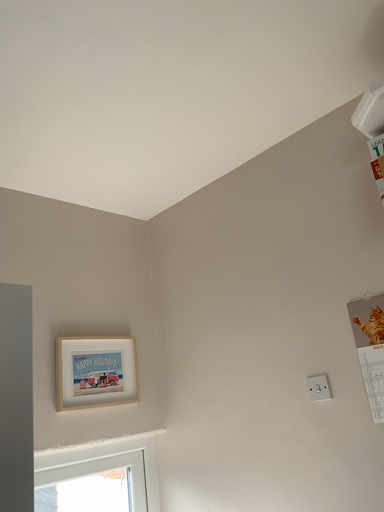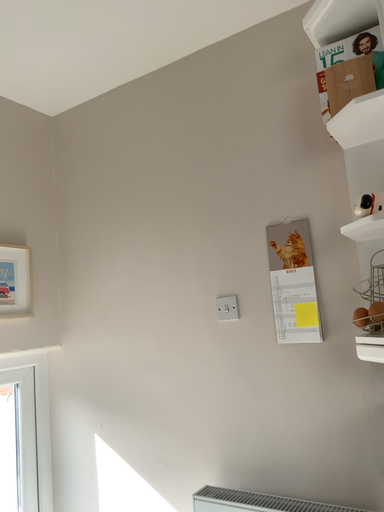
Question: Which way did the camera rotate in the video?

Choices:
 (A) rotated upward
 (B) rotated downward

Answer: (B)